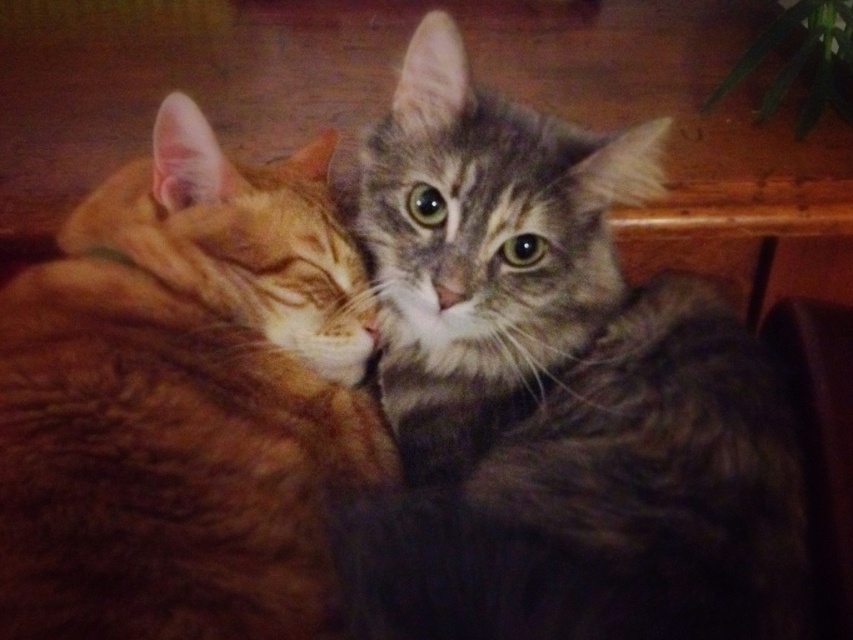
Which is in front, point (683, 333) or point (77, 234)?

Positioned in front is point (683, 333).

Is point (438, 413) behind point (215, 326)?

Yes, it is behind point (215, 326).

Where is `tabby fur cat at center`? The width and height of the screenshot is (853, 640). tabby fur cat at center is located at coordinates (560, 392).